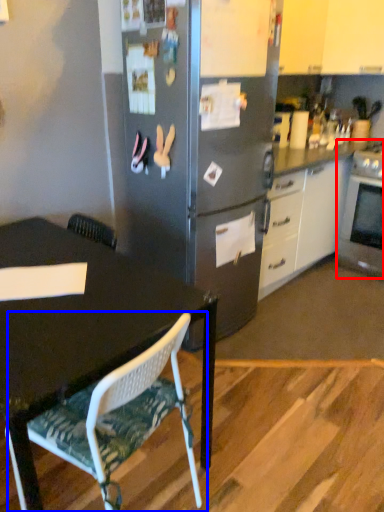
Question: Which point is further to the camera, oven (highlighted by a red box) or chair (highlighted by a blue box)?

Choices:
 (A) oven
 (B) chair

Answer: (A)